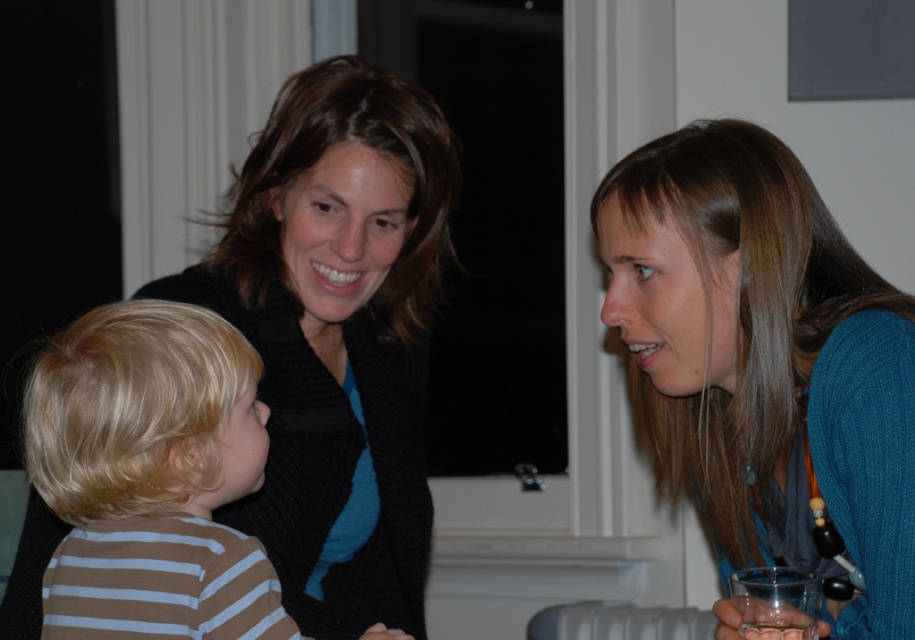
You are a tailor measuring clothes for a customer. You see the blue knitted sweater at right and the brown striped shirt at lower left. Which one requires a longer vertical measurement for its fabric?

The blue knitted sweater at right is taller than the brown striped shirt at lower left, so the blue knitted sweater at right requires a longer vertical measurement for its fabric.

What are the coordinates of the blue knitted sweater at right?

The blue knitted sweater at right is located at coordinates point (763, 358).

What is the 2D coordinate of the matte black sweater at upper left?

The 2D coordinate of the matte black sweater at upper left is at point (338, 333).